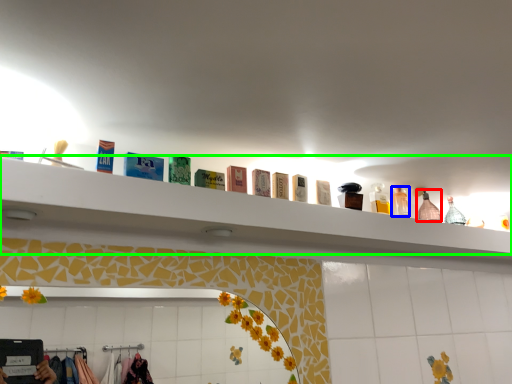
Question: Which is farther away from bottle (highlighted by a red box)? toiletry (highlighted by a blue box) or shelf (highlighted by a green box)?

Choices:
 (A) toiletry
 (B) shelf

Answer: (B)